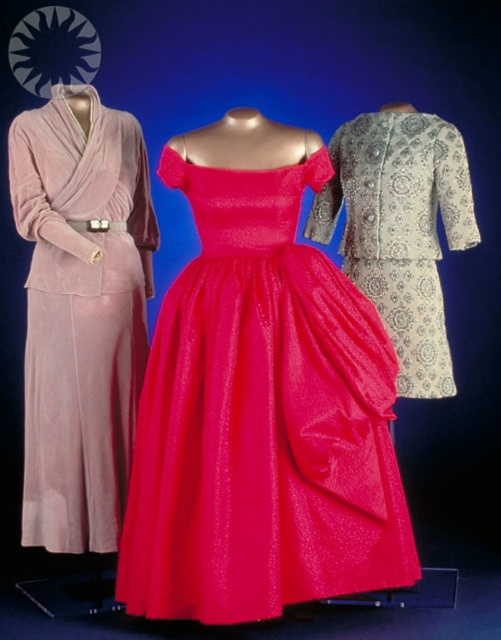
Is point (288, 422) farther from viewer compared to point (446, 152)?

No, (288, 422) is in front of (446, 152).

Does shiny taffeta dress at center have a lesser width compared to silver metallic dress at right?

No.

The height and width of the screenshot is (640, 501). I want to click on shiny taffeta dress at center, so click(261, 419).

Between shiny taffeta dress at center and velvet pink dress at left, which one is positioned higher?

velvet pink dress at left

Can you confirm if shiny taffeta dress at center is positioned below velvet pink dress at left?

Yes, shiny taffeta dress at center is below velvet pink dress at left.

Between point (282, 467) and point (34, 310), which one is positioned in front?

Positioned in front is point (282, 467).

The image size is (501, 640). What are the coordinates of `shiny taffeta dress at center` in the screenshot? It's located at coord(261,419).

Is velvet pink dress at left wider than silver metallic dress at right?

In fact, velvet pink dress at left might be narrower than silver metallic dress at right.

Is velvet pink dress at left positioned before silver metallic dress at right?

Yes, velvet pink dress at left is closer to the viewer.

What do you see at coordinates (81, 312) in the screenshot? I see `velvet pink dress at left` at bounding box center [81, 312].

At what (x,y) coordinates should I click in order to perform the action: click on velvet pink dress at left. Please return your answer as a coordinate pair (x, y). Looking at the image, I should click on (81, 312).